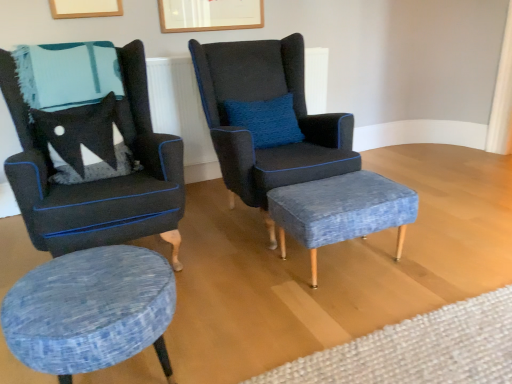
Locate an element on the screen. Image resolution: width=512 pixels, height=384 pixels. vacant space underneath blue fabric stool at center, which appears as the 2th stool when viewed from the front (from a real-world perspective) is located at coordinates click(341, 263).